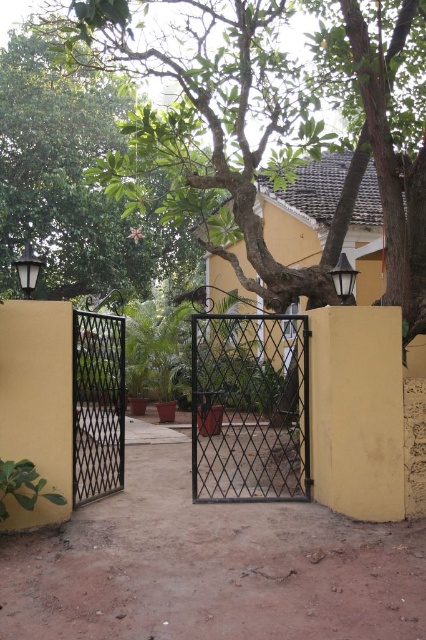
Question: Which is farther from the black metal gate at left?

Choices:
 (A) black wrought iron gate at center
 (B) green leafy tree at center

Answer: (B)

Question: Is green leafy tree at center positioned behind black wrought iron gate at center?

Choices:
 (A) no
 (B) yes

Answer: (B)

Question: Which of the following is the farthest from the observer?

Choices:
 (A) click(74, 349)
 (B) click(399, 88)

Answer: (B)

Question: Is green leafy tree at center wider than black wrought iron gate at center?

Choices:
 (A) yes
 (B) no

Answer: (B)

Question: Which object is closer to the camera taking this photo?

Choices:
 (A) black metal gate at left
 (B) green leafy tree at center

Answer: (A)

Question: Is black wrought iron gate at center in front of black metal gate at left?

Choices:
 (A) yes
 (B) no

Answer: (A)